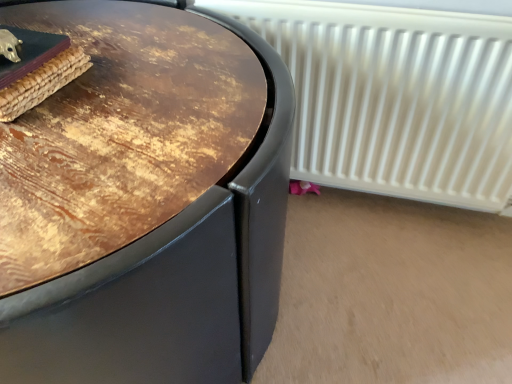
This screenshot has height=384, width=512. What are the coordinates of `free space above white matte radiator at upper right (from a real-world perspective)` in the screenshot? It's located at (359, 6).